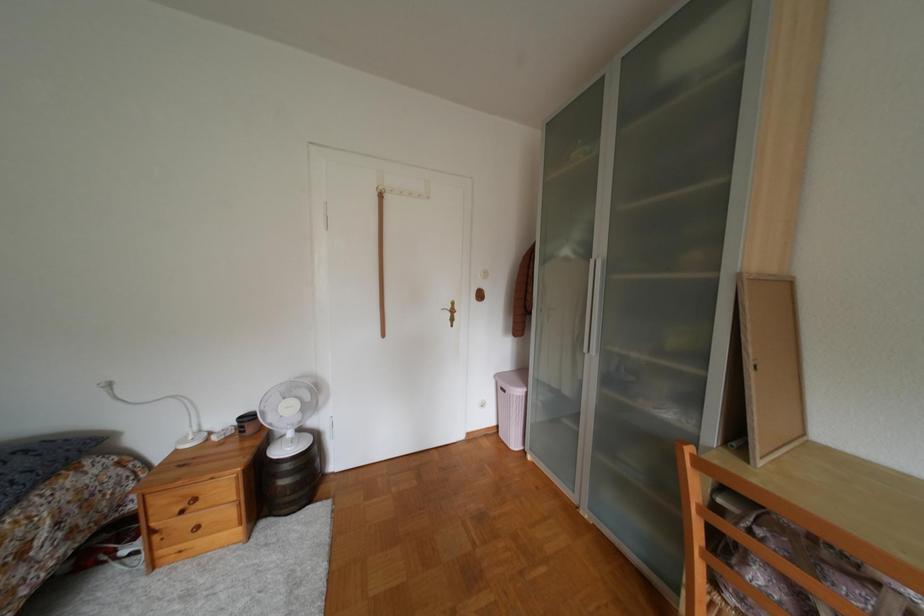
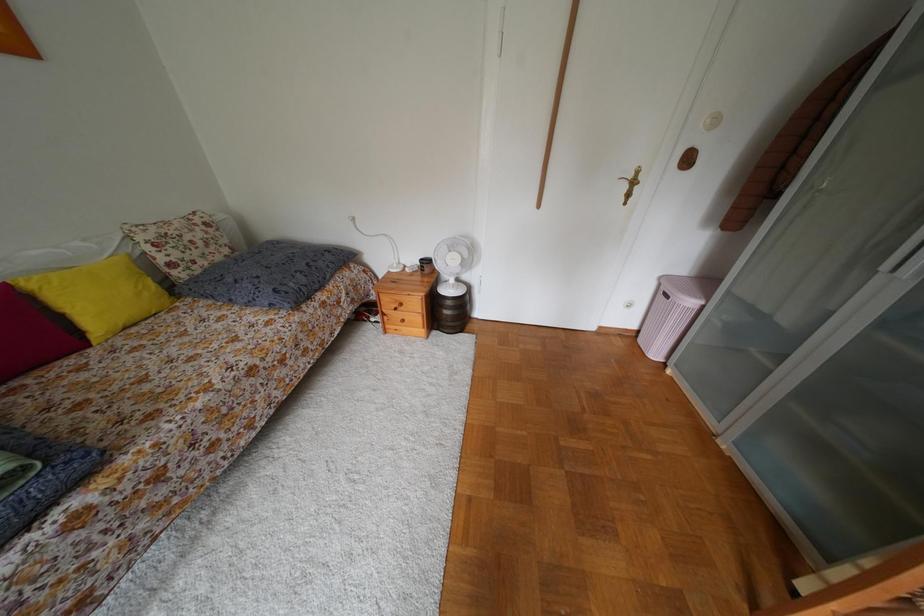
How did the camera likely rotate?

The camera rotated toward left-down.